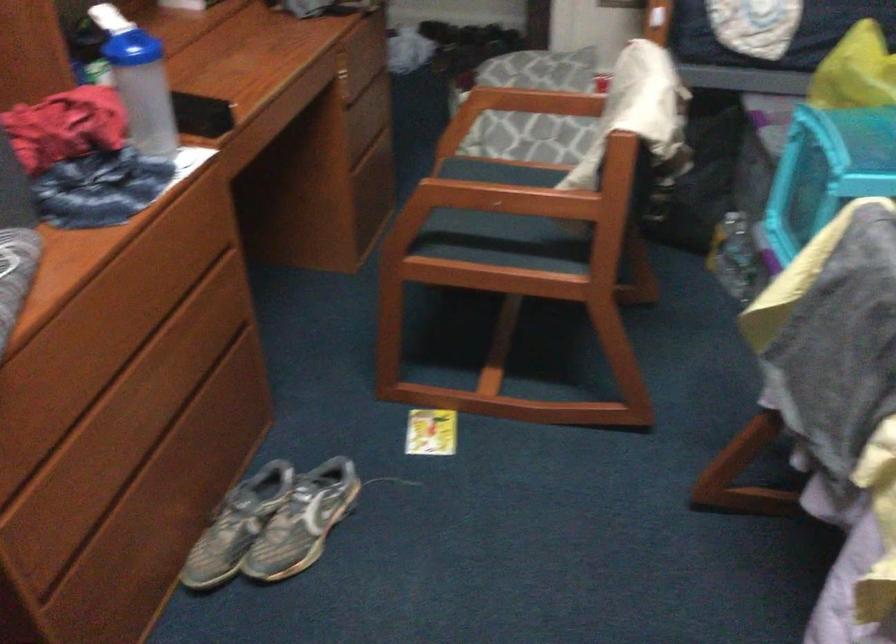
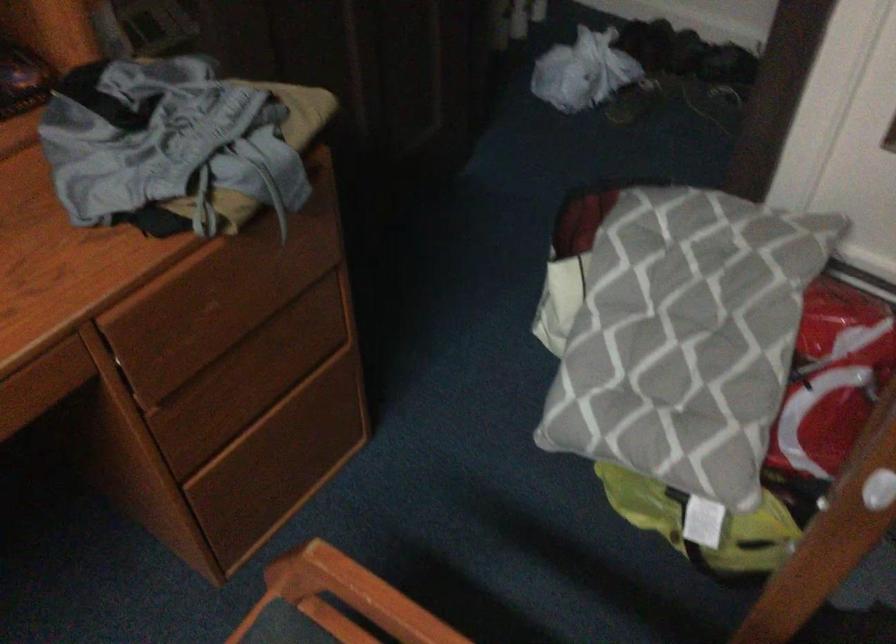
Find the pixel in the second image that matches point 364,115 in the first image.

(254, 377)